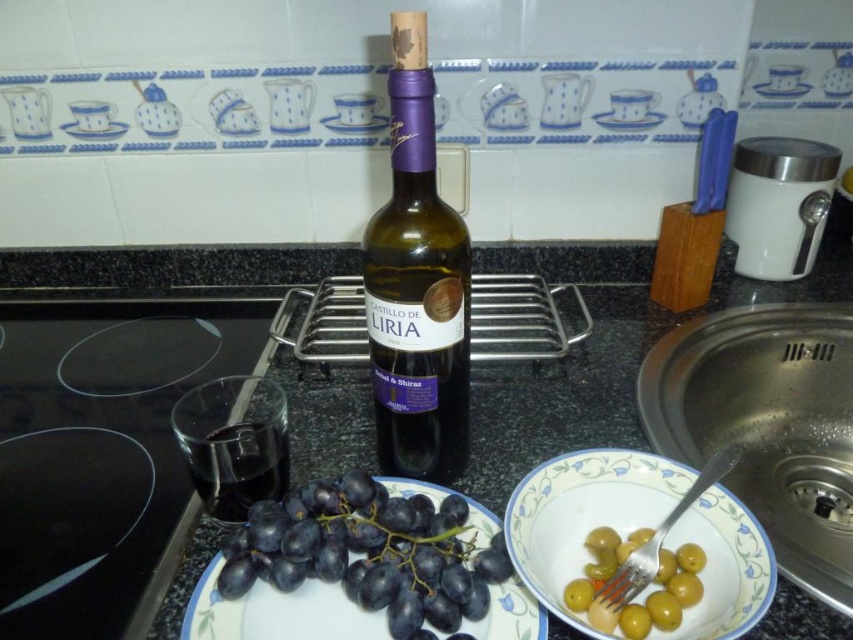
You are standing in the kitchen and want to wash your hands. Where is the stainless steel sink at lower right located?

The stainless steel sink at lower right is located at point 0.664 on the x axis and 0.900 on the y axis.